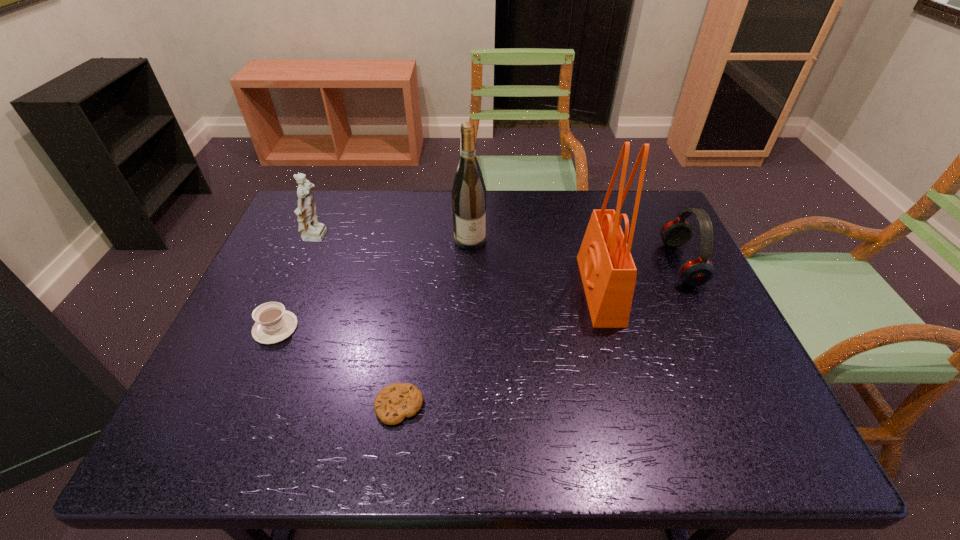
Where is `vacant space in between the fourth object from left to right and the fourth tallest object`? This screenshot has height=540, width=960. vacant space in between the fourth object from left to right and the fourth tallest object is located at coordinates (576, 252).

Where is `vacant space that's between the third shortest object and the third object from left to right`? vacant space that's between the third shortest object and the third object from left to right is located at coordinates (540, 335).

Identify the location of unoccupied position between the wine bottle and the third shortest object. This screenshot has width=960, height=540. (576, 252).

At what (x,y) coordinates should I click in order to perform the action: click on object identified as the fifth closest to the earphone. Please return your answer as a coordinate pair (x, y). The height and width of the screenshot is (540, 960). Looking at the image, I should click on (274, 324).

Where is `object that stands as the third closest to the tote bag`? This screenshot has width=960, height=540. object that stands as the third closest to the tote bag is located at coordinates (393, 403).

Where is `free space that satisfies the following two spatial constraints: 1. on the front-facing side of the figurine; 2. on the back side of the third object from right to left`? The width and height of the screenshot is (960, 540). free space that satisfies the following two spatial constraints: 1. on the front-facing side of the figurine; 2. on the back side of the third object from right to left is located at coordinates [317, 239].

Find the location of a particular element. Image resolution: width=960 pixels, height=540 pixels. free space that satisfies the following two spatial constraints: 1. on the handle side of the teacup; 2. on the back side of the cookie is located at coordinates (242, 406).

Locate an element on the screen. This screenshot has width=960, height=540. vacant area that satisfies the following two spatial constraints: 1. on the front-facing side of the fifth shortest object; 2. on the left side of the fourth shortest object is located at coordinates (317, 239).